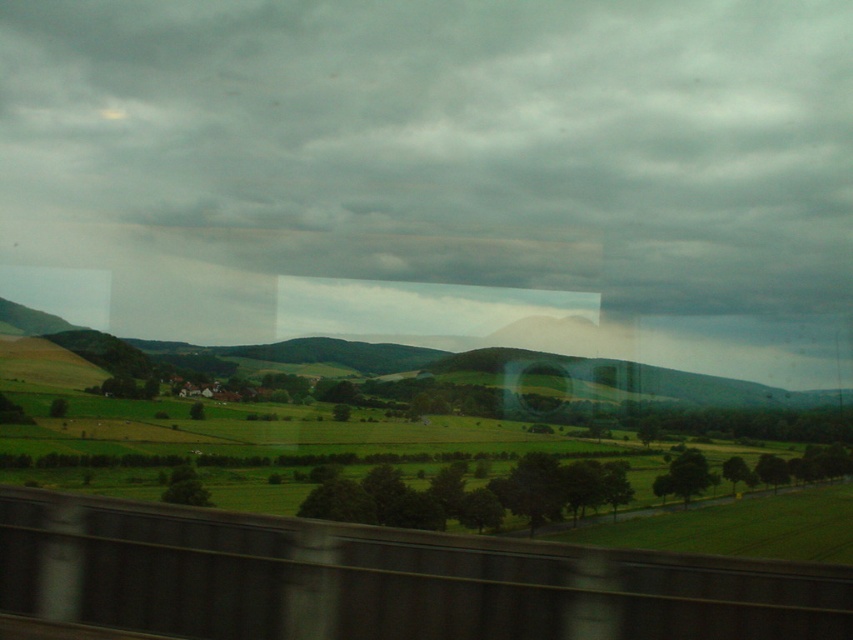
Question: Is gray cloudy sky at upper center above smooth concrete train track at bottom center?

Choices:
 (A) no
 (B) yes

Answer: (B)

Question: Does gray cloudy sky at upper center appear under smooth concrete train track at bottom center?

Choices:
 (A) yes
 (B) no

Answer: (B)

Question: Which point is farther from the camera taking this photo?

Choices:
 (A) 97,76
 (B) 364,579

Answer: (A)

Question: Which object appears closest to the camera in this image?

Choices:
 (A) gray cloudy sky at upper center
 (B) smooth concrete train track at bottom center

Answer: (B)

Question: Is gray cloudy sky at upper center closer to camera compared to smooth concrete train track at bottom center?

Choices:
 (A) no
 (B) yes

Answer: (A)